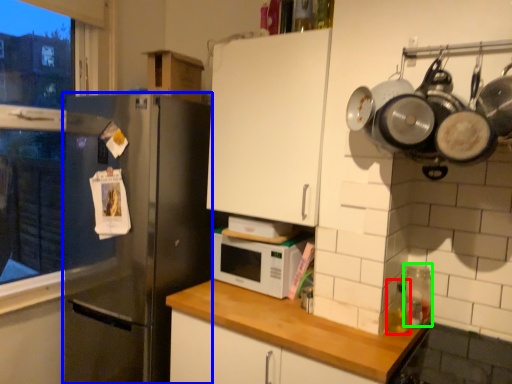
Question: Which is farther away from bottle (highlighted by a red box)? refrigerator (highlighted by a blue box) or appliance (highlighted by a green box)?

Choices:
 (A) refrigerator
 (B) appliance

Answer: (A)